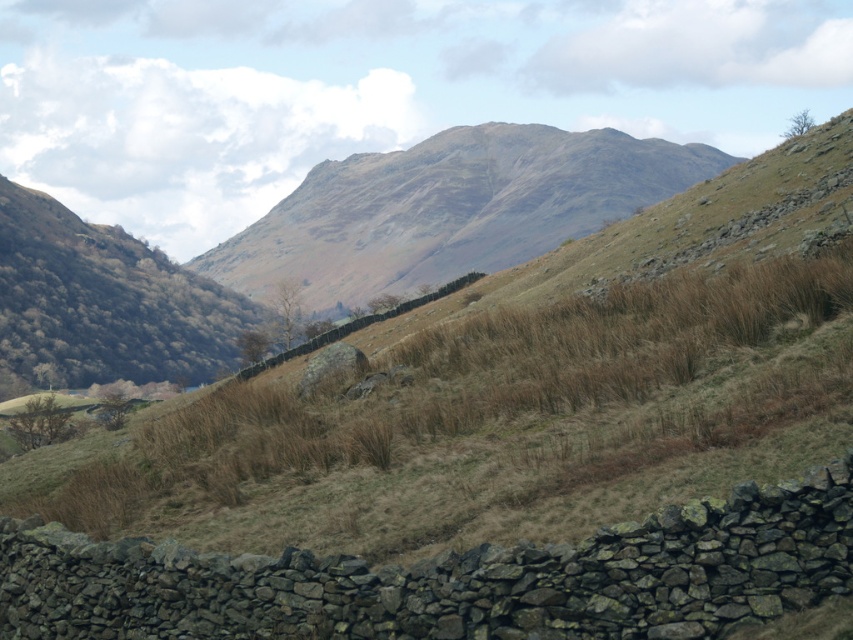
Question: Does brown dry grass at center appear under rugged stone mountain at center?

Choices:
 (A) no
 (B) yes

Answer: (B)

Question: Considering the relative positions of brown dry grass at center and rugged stone mountain at center in the image provided, where is brown dry grass at center located with respect to rugged stone mountain at center?

Choices:
 (A) left
 (B) right

Answer: (A)

Question: Which of the following is the closest to the observer?

Choices:
 (A) brown dry grass at center
 (B) rugged stone mountain at center

Answer: (A)

Question: In this image, where is brown dry grass at center located relative to rugged stone mountain at center?

Choices:
 (A) below
 (B) above

Answer: (A)